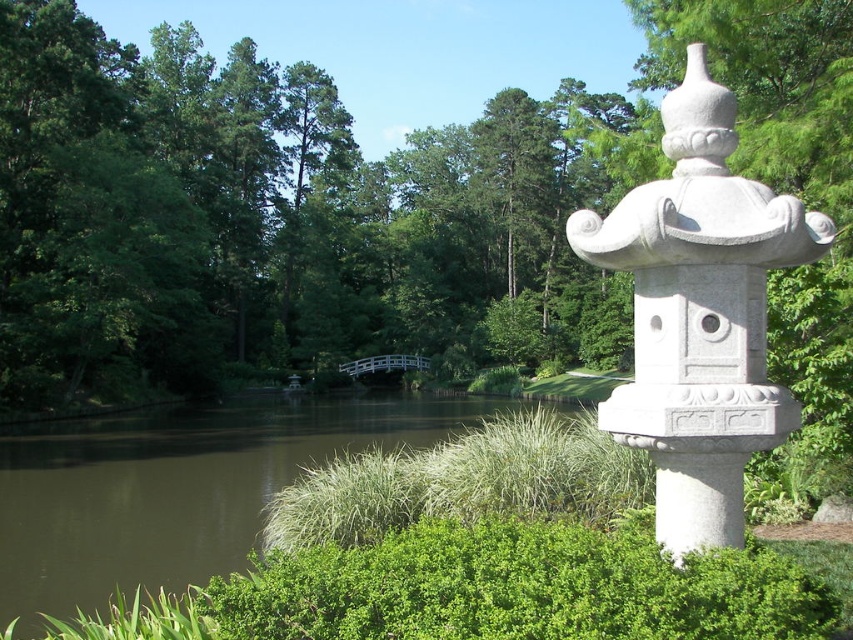
Does white stone lantern at upper right lie behind brown water at center?

No, white stone lantern at upper right is in front of brown water at center.

Between point (680, 468) and point (421, 403), which one is positioned behind?

The point (421, 403) is behind.

Find the location of a particular element. This screenshot has width=853, height=640. white stone lantern at upper right is located at coordinates (699, 314).